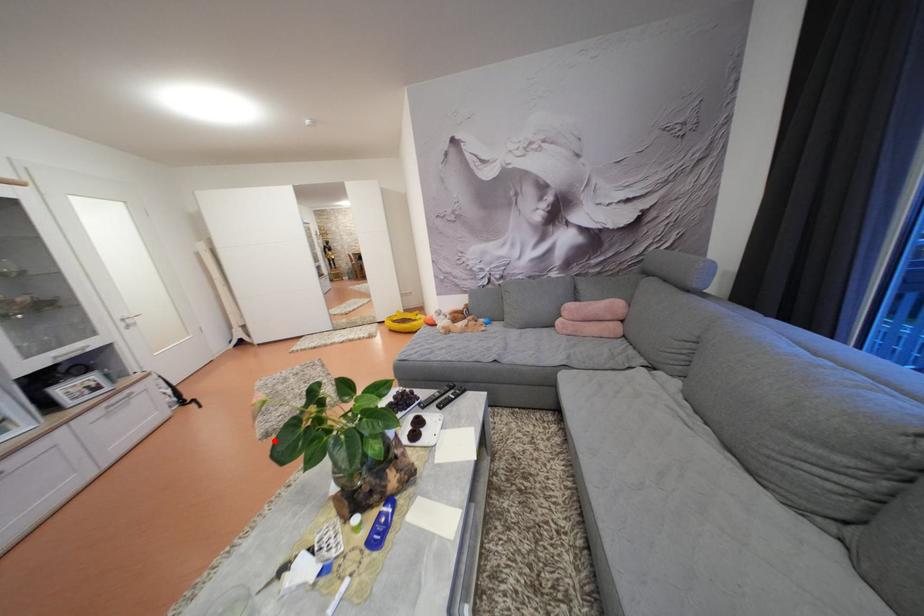
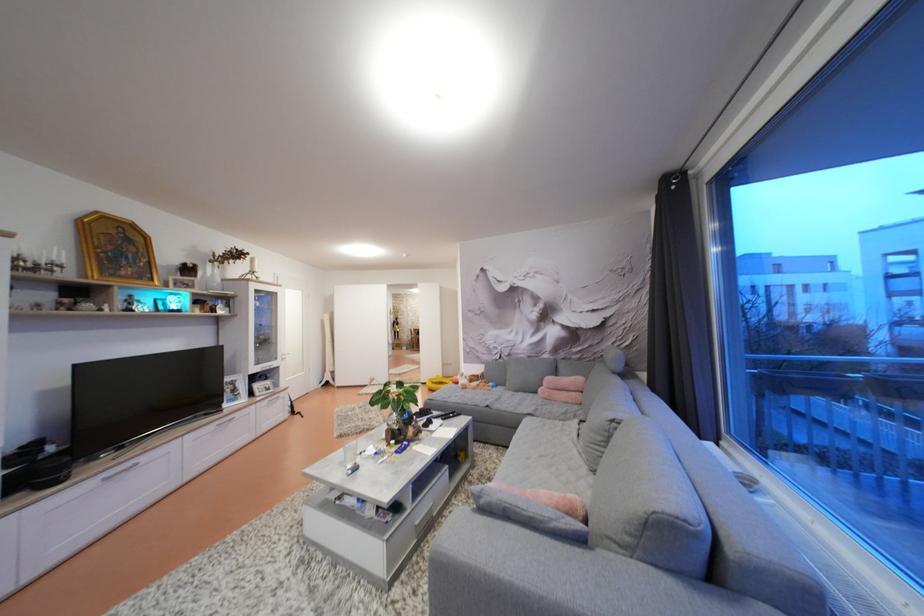
Question: I am providing you with two images of the same scene from different viewpoints. Given a red point in image1, look at the same physical point in image2. Is it:

Choices:
 (A) Closer to the viewpoint
 (B) Farther from the viewpoint

Answer: (A)